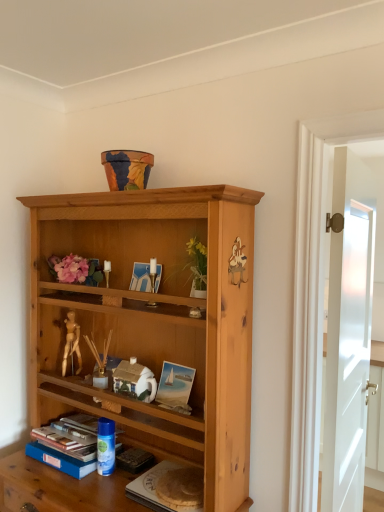
Question: Is blue hardcover book at lower left smaller than blue plastic can at lower center?

Choices:
 (A) no
 (B) yes

Answer: (A)

Question: Does blue hardcover book at lower left have a lesser height compared to blue plastic can at lower center?

Choices:
 (A) yes
 (B) no

Answer: (A)

Question: Can you confirm if blue hardcover book at lower left is positioned to the right of blue plastic can at lower center?

Choices:
 (A) no
 (B) yes

Answer: (A)

Question: From the image's perspective, is blue hardcover book at lower left on blue plastic can at lower center?

Choices:
 (A) yes
 (B) no

Answer: (B)

Question: Is blue hardcover book at lower left far from blue plastic can at lower center?

Choices:
 (A) yes
 (B) no

Answer: (B)

Question: Looking at the image, does white glossy door at right seem bigger or smaller compared to blue hardcover book at lower left?

Choices:
 (A) big
 (B) small

Answer: (A)

Question: In terms of height, does white glossy door at right look taller or shorter compared to blue hardcover book at lower left?

Choices:
 (A) tall
 (B) short

Answer: (A)

Question: Is point pos(342,486) closer or farther from the camera than point pos(92,448)?

Choices:
 (A) closer
 (B) farther

Answer: (B)

Question: From the image's perspective, relative to blue hardcover book at lower left, is white glossy door at right above or below?

Choices:
 (A) above
 (B) below

Answer: (A)

Question: Would you say blue plastic can at lower center is inside or outside white glossy door at right?

Choices:
 (A) outside
 (B) inside

Answer: (A)

Question: Is point (112, 452) closer or farther from the camera than point (337, 292)?

Choices:
 (A) farther
 (B) closer

Answer: (A)

Question: Considering their positions, is blue plastic can at lower center located in front of or behind white glossy door at right?

Choices:
 (A) front
 (B) behind

Answer: (B)

Question: From a real-world perspective, relative to white glossy door at right, is blue plastic can at lower center vertically above or below?

Choices:
 (A) below
 (B) above

Answer: (A)

Question: Considering the positions of white glossy door at right and hardcover book at lower center in the image, is white glossy door at right bigger or smaller than hardcover book at lower center?

Choices:
 (A) small
 (B) big

Answer: (B)

Question: From a real-world perspective, relative to hardcover book at lower center, is white glossy door at right vertically above or below?

Choices:
 (A) above
 (B) below

Answer: (A)